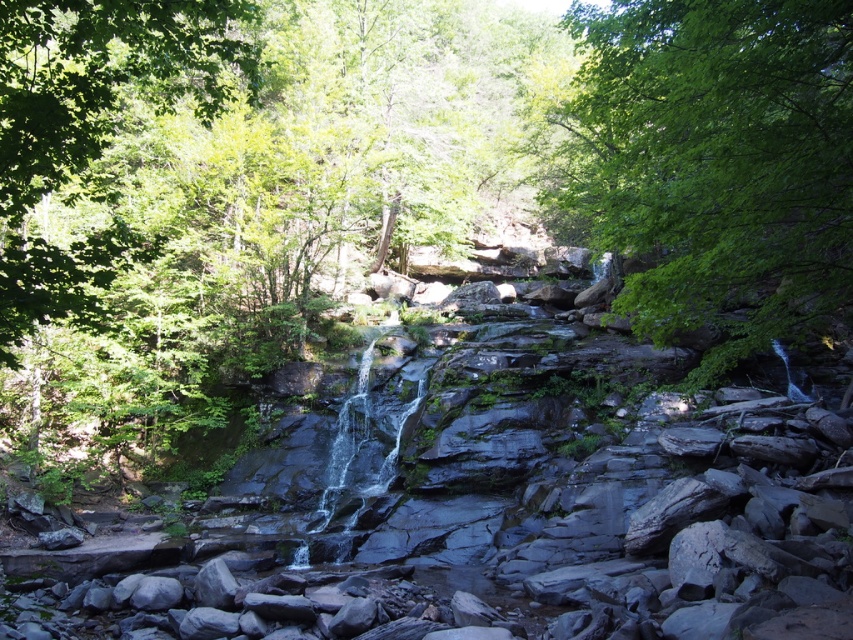
Question: In this image, where is green leafy tree at center located relative to green leafy tree at upper left?

Choices:
 (A) below
 (B) above

Answer: (B)

Question: Which object appears closest to the camera in this image?

Choices:
 (A) green leafy tree at upper left
 (B) green leafy tree at center

Answer: (A)

Question: Considering the relative positions of green leafy tree at center and green leafy tree at upper left in the image provided, where is green leafy tree at center located with respect to green leafy tree at upper left?

Choices:
 (A) above
 (B) below

Answer: (A)

Question: Which point is closer to the camera taking this photo?

Choices:
 (A) (709, 241)
 (B) (62, 273)

Answer: (B)

Question: Is green leafy tree at center thinner than green leafy tree at upper left?

Choices:
 (A) yes
 (B) no

Answer: (A)

Question: Among these objects, which one is farthest from the camera?

Choices:
 (A) green leafy tree at upper left
 (B) green leafy tree at center

Answer: (B)